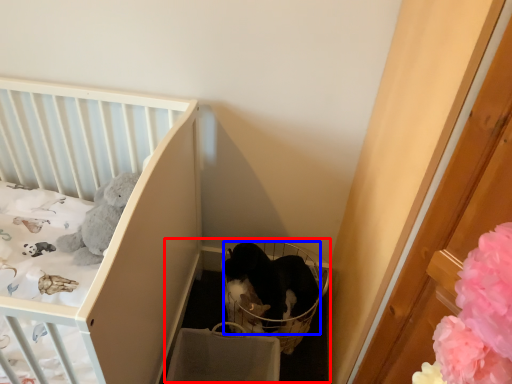
Question: Which object appears closest to the camera in this image, baby carriage (highlighted by a red box) or cat (highlighted by a blue box)?

Choices:
 (A) baby carriage
 (B) cat

Answer: (A)